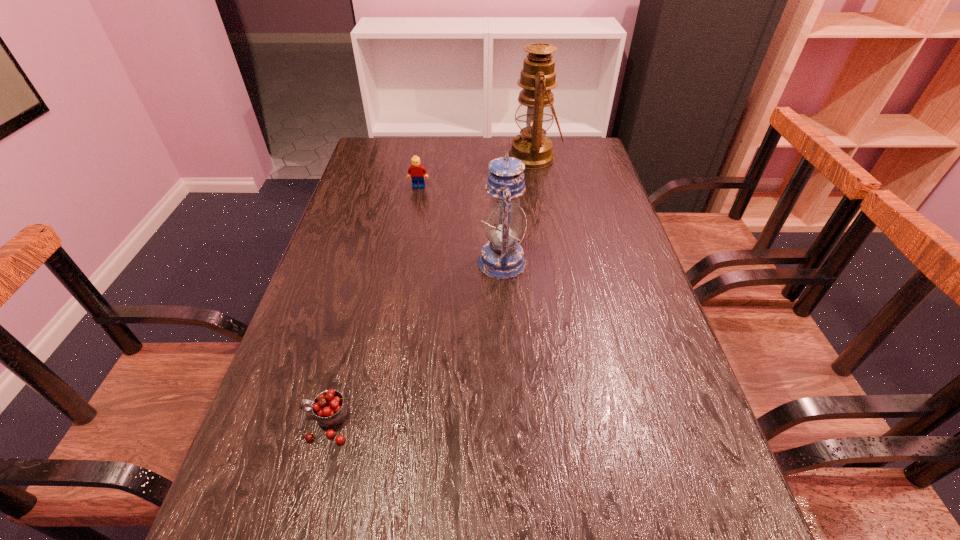
At what (x,y) coordinates should I click in order to perform the action: click on blank space at the right edge. Please return your answer as a coordinate pair (x, y). The image size is (960, 540). Looking at the image, I should click on (616, 339).

Where is `vacant region at the far left corner`? This screenshot has width=960, height=540. vacant region at the far left corner is located at coordinates (370, 152).

Image resolution: width=960 pixels, height=540 pixels. I want to click on free space at the far right corner of the desktop, so click(x=585, y=140).

Find the location of a particular element. The image size is (960, 540). vacant point located between the third nearest object and the oil lamp is located at coordinates (476, 172).

You are a GUI agent. You are given a task and a screenshot of the screen. Output one action in this format:
    pyautogui.click(x=<x>, y=<y>)
    Task: Click on the free space between the second nearest object and the second shortest object
    
    Given the screenshot: What is the action you would take?
    pyautogui.click(x=460, y=225)

Locate an element on the screen. Image resolution: width=960 pixels, height=540 pixels. free area in between the nearest object and the third nearest object is located at coordinates (372, 305).

The height and width of the screenshot is (540, 960). I want to click on blank region between the lantern and the second shortest object, so click(460, 225).

The image size is (960, 540). I want to click on vacant area that lies between the farthest object and the leftmost object, so click(x=430, y=291).

Point out which object is positioned as the third nearest to the second nearest object. Please provide its 2D coordinates. Your answer should be formatted as a tuple, i.e. [(x, y)], where the tuple contains the x and y coordinates of a point satisfying the conditions above.

[(330, 409)]

The width and height of the screenshot is (960, 540). Identify the location of object that stands as the second closest to the third farthest object. (535, 109).